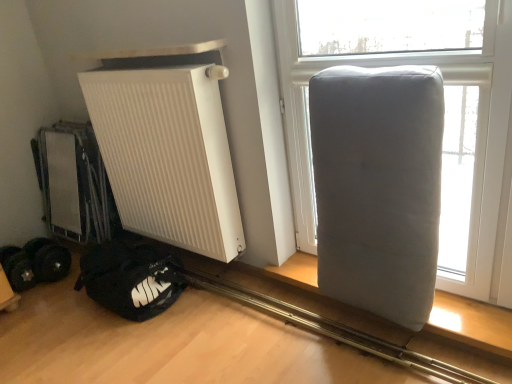
You are a GUI agent. You are given a task and a screenshot of the screen. Output one action in this format:
    pyautogui.click(x=<x>, y=<y>)
    Task: Click on the vacant region below gray fabric mattress at right (from a real-world perspective)
    
    Given the screenshot: What is the action you would take?
    (x=367, y=321)